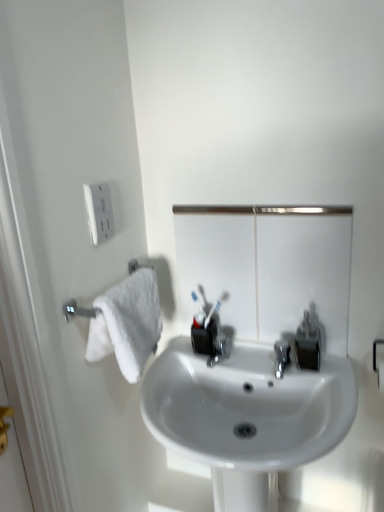
The height and width of the screenshot is (512, 384). Find the location of `vacant area on top of metallic reflective mirror at center (from a real-world perspective)`. vacant area on top of metallic reflective mirror at center (from a real-world perspective) is located at coordinates (258, 204).